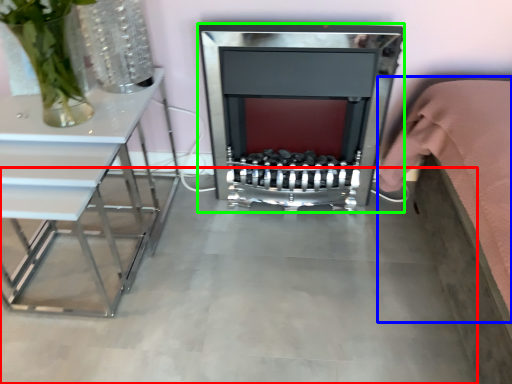
Question: Which object is the closest to the concrete (highlighted by a red box)? Choose among these: bed (highlighted by a blue box) or fireplace (highlighted by a green box).

Choices:
 (A) bed
 (B) fireplace

Answer: (B)